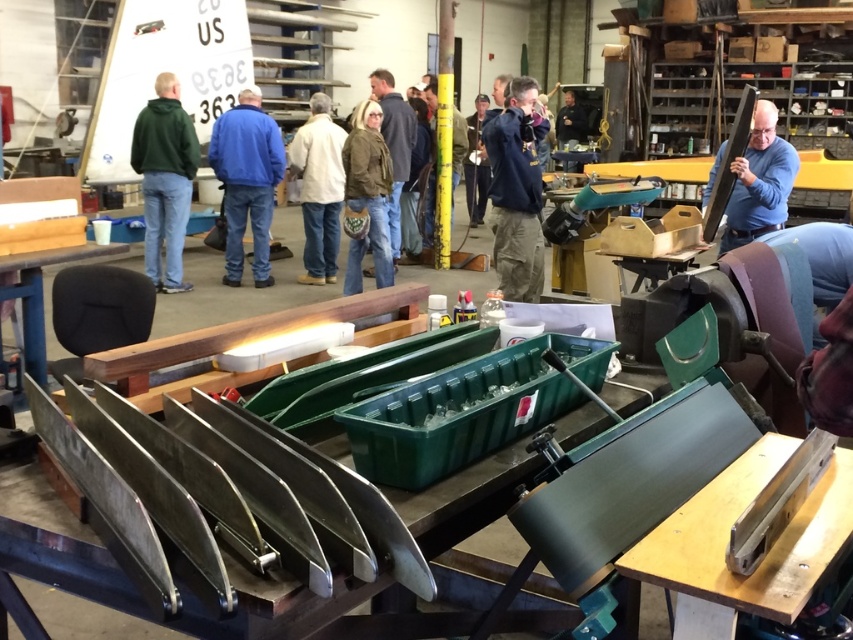
Question: Considering the real-world distances, which object is closest to the dark blue jacket at center?

Choices:
 (A) green matte hoodie at left
 (B) white matte jacket at center
 (C) yellow matte pole at center
 (D) denim jacket at center

Answer: (D)

Question: Is dark blue jacket at center below matte black board at right?

Choices:
 (A) no
 (B) yes

Answer: (B)

Question: Does blue cotton jacket at center appear over brown leather jacket at center?

Choices:
 (A) yes
 (B) no

Answer: (B)

Question: Does dark blue jacket at center appear under white matte jacket at center?

Choices:
 (A) no
 (B) yes

Answer: (B)

Question: Which object is the farthest from the blue cotton jacket at center?

Choices:
 (A) green matte hoodie at left
 (B) white matte jacket at center
 (C) yellow matte pole at center

Answer: (C)

Question: Which of the following is the farthest from the observer?

Choices:
 (A) (352, 145)
 (B) (234, 280)

Answer: (B)